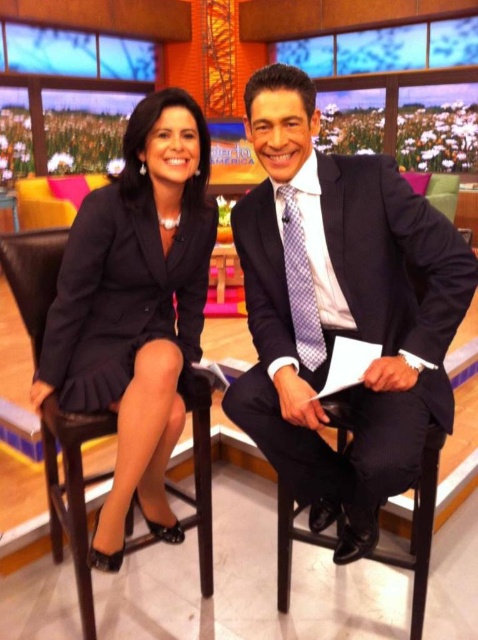
Question: Where is matte black dress at left located in relation to black satin dress at left in the image?

Choices:
 (A) below
 (B) above

Answer: (A)

Question: Does dark blue pinstripe suit at center have a lesser width compared to purple checkered tie at center?

Choices:
 (A) yes
 (B) no

Answer: (B)

Question: Which is farther from the purple checkered tie at center?

Choices:
 (A) dark blue pinstripe suit at center
 (B) black satin dress at left
 (C) matte black dress at left

Answer: (B)

Question: Can you confirm if matte black dress at left is thinner than purple checkered tie at center?

Choices:
 (A) yes
 (B) no

Answer: (B)

Question: Considering the real-world distances, which object is closest to the matte black dress at left?

Choices:
 (A) purple checkered tie at center
 (B) dark blue pinstripe suit at center
 (C) black satin dress at left

Answer: (C)

Question: Estimate the real-world distances between objects in this image. Which object is farther from the dark blue pinstripe suit at center?

Choices:
 (A) matte black dress at left
 (B) purple checkered tie at center

Answer: (A)